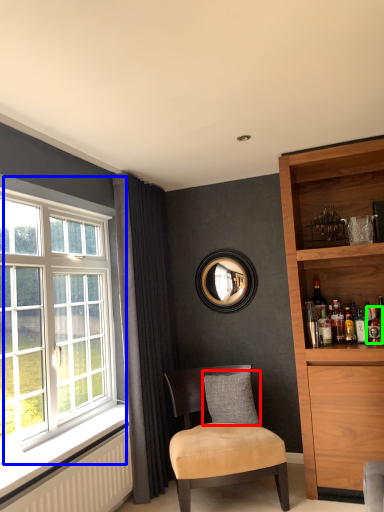
Question: Considering the real-world distances, which object is farthest from pillow (highlighted by a red box)? window (highlighted by a blue box) or beverage (highlighted by a green box)?

Choices:
 (A) window
 (B) beverage

Answer: (A)